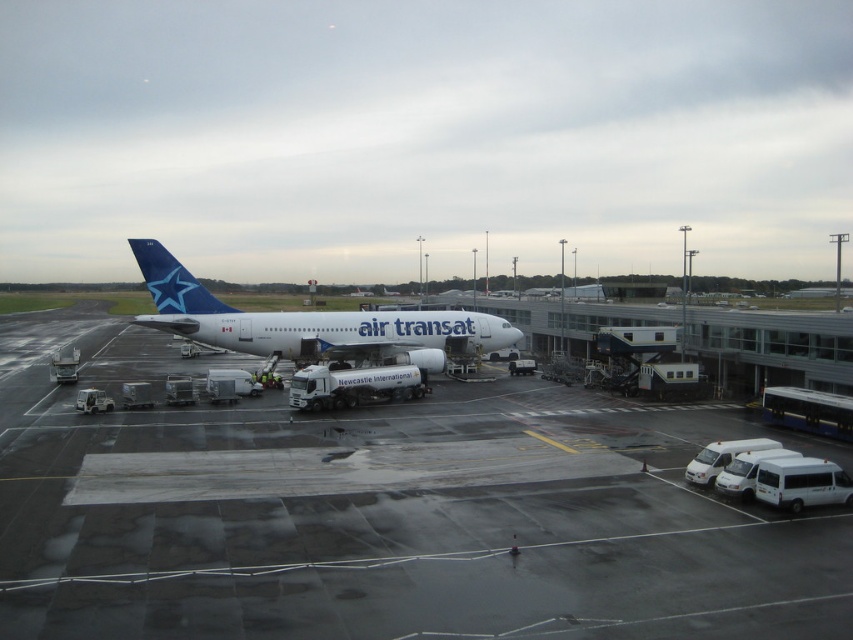
Question: Can you confirm if smooth asphalt tarmac at center is smaller than white glossy airplane at center?

Choices:
 (A) yes
 (B) no

Answer: (B)

Question: Which object is closer to the camera taking this photo?

Choices:
 (A) white glossy airplane at center
 (B) smooth asphalt tarmac at center

Answer: (B)

Question: Is smooth asphalt tarmac at center in front of white glossy airplane at center?

Choices:
 (A) no
 (B) yes

Answer: (B)

Question: Does smooth asphalt tarmac at center appear on the left side of white glossy airplane at center?

Choices:
 (A) yes
 (B) no

Answer: (B)

Question: Which of the following is the farthest from the observer?

Choices:
 (A) (444, 326)
 (B) (404, 467)

Answer: (A)